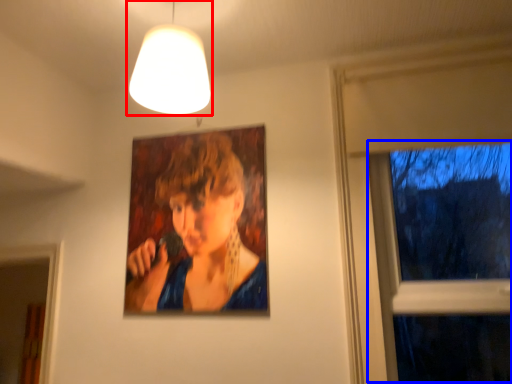
Question: Which object appears farthest to the camera in this image, lamp (highlighted by a red box) or window (highlighted by a blue box)?

Choices:
 (A) lamp
 (B) window

Answer: (B)